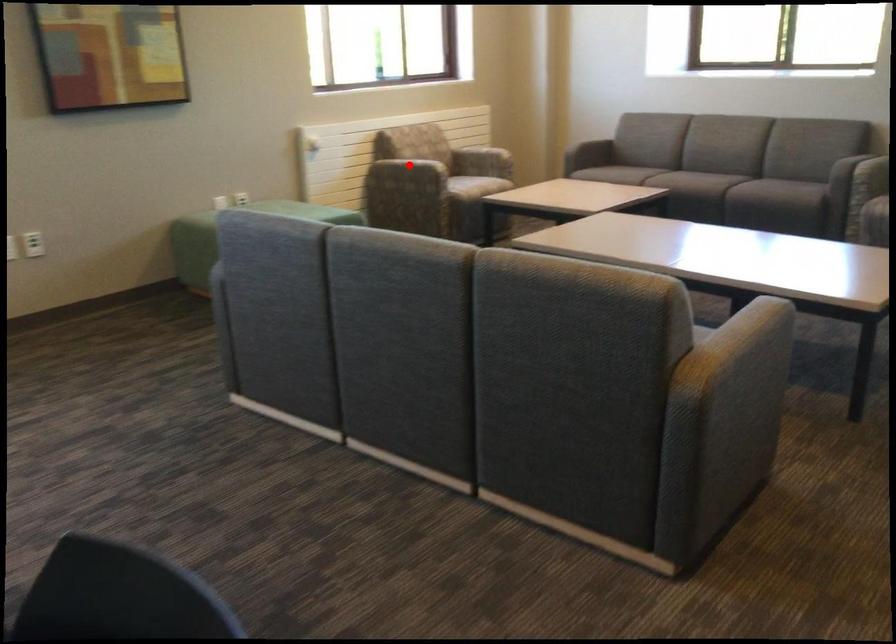
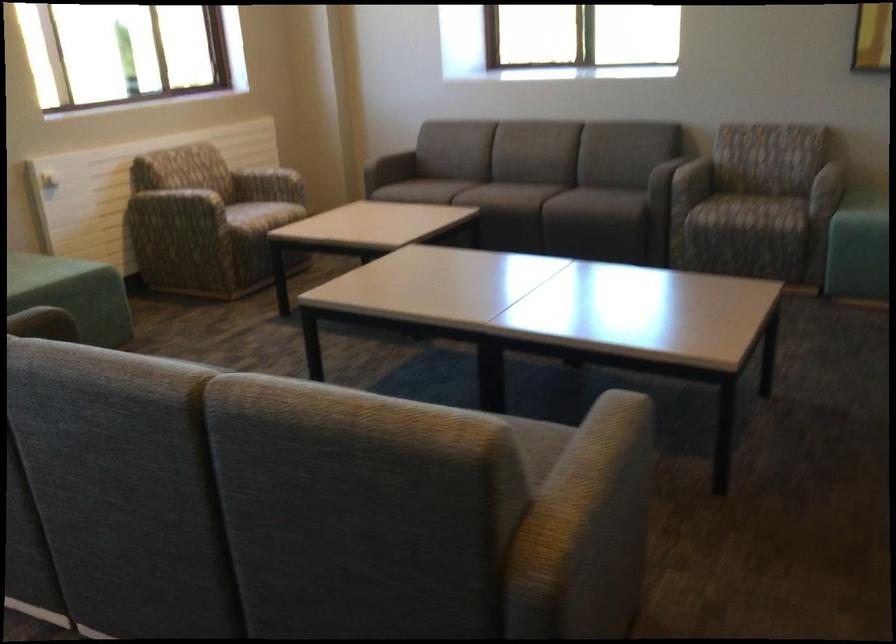
Question: I am providing you with two images of the same scene from different viewpoints. In image1, a red point is highlighted. Considering the same 3D point in image2, which of the following is correct?

Choices:
 (A) It is closer
 (B) It is farther

Answer: (A)